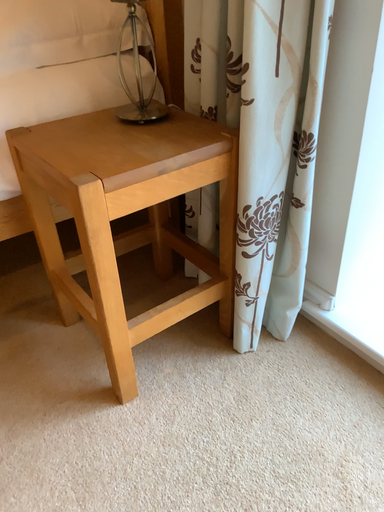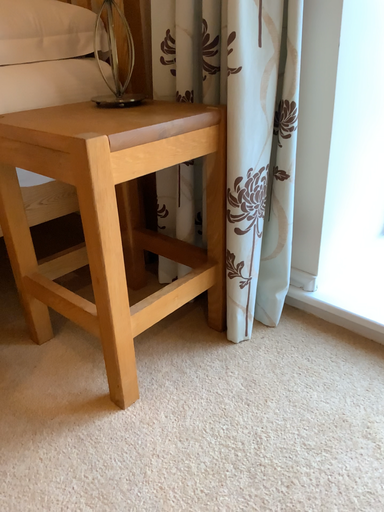
Question: Which way did the camera rotate in the video?

Choices:
 (A) rotated upward
 (B) rotated downward

Answer: (A)